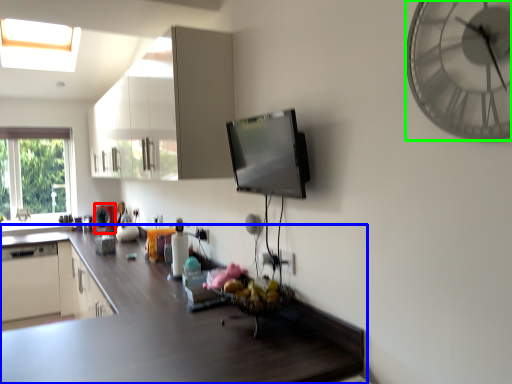
Question: Based on their relative distances, which object is nearer to appliance (highlighted by a red box)? Choose from countertop (highlighted by a blue box) and wall clock (highlighted by a green box).

Choices:
 (A) countertop
 (B) wall clock

Answer: (A)